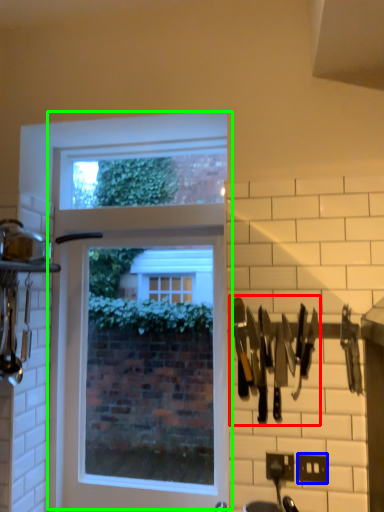
Question: Estimate the real-world distances between objects in this image. Which object is farther from cutlery (highlighted by a red box), electric outlet (highlighted by a blue box) or window (highlighted by a green box)?

Choices:
 (A) electric outlet
 (B) window

Answer: (B)